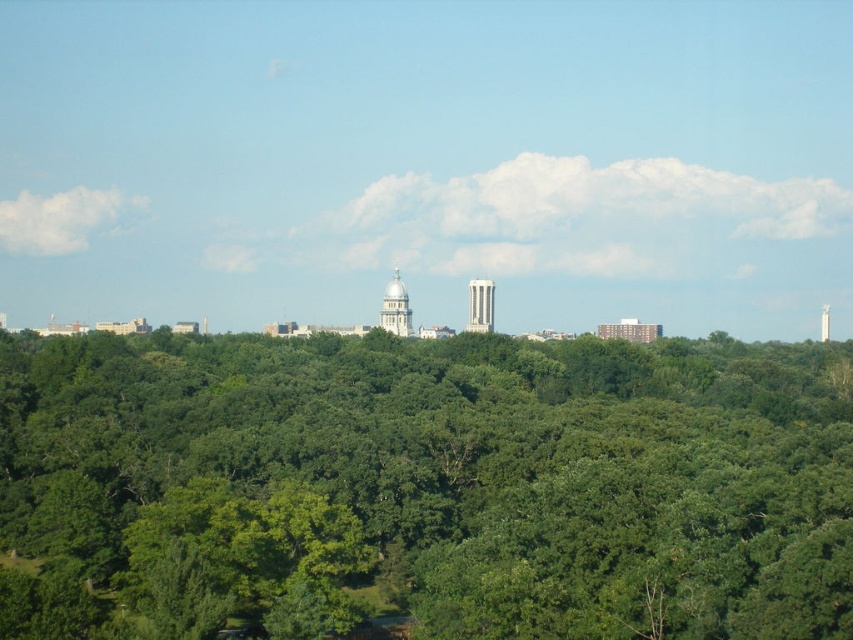
Is green leafy forest at center above white smooth tower at center?

No, green leafy forest at center is not above white smooth tower at center.

Describe the element at coordinates (426, 484) in the screenshot. The image size is (853, 640). I see `green leafy forest at center` at that location.

In order to click on green leafy forest at center in this screenshot , I will do `click(426, 484)`.

The image size is (853, 640). Find the location of `white glossy water tower at center`. white glossy water tower at center is located at coordinates (395, 307).

In the scene shown: Does white glossy water tower at center lie in front of white smooth water tower at upper center?

Yes, white glossy water tower at center is in front of white smooth water tower at upper center.

Is point (410, 310) less distant than point (827, 330)?

Yes, it is in front of point (827, 330).

At what (x,y) coordinates should I click in order to perform the action: click on white glossy water tower at center. Please return your answer as a coordinate pair (x, y). The width and height of the screenshot is (853, 640). Looking at the image, I should click on (395, 307).

Which is above, green leafy forest at center or white glossy water tower at center?

white glossy water tower at center

Who is more distant from viewer, (103, 630) or (399, 291)?

The point (103, 630) is more distant.

Is point (155, 468) in front of point (381, 326)?

That is False.

Locate an element on the screen. This screenshot has width=853, height=640. green leafy forest at center is located at coordinates (426, 484).